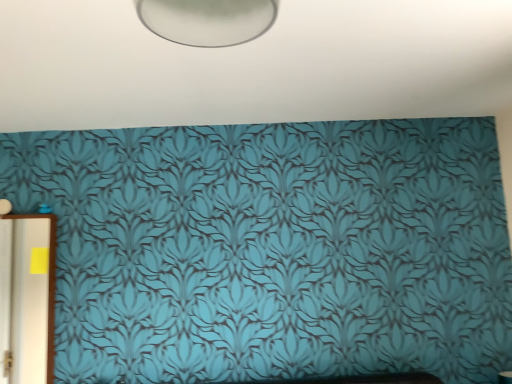
At what (x,y) coordinates should I click in order to perform the action: click on white glossy door at left. Please return your answer as a coordinate pair (x, y). The image size is (512, 384). Looking at the image, I should click on (29, 297).

What do you see at coordinates (29, 297) in the screenshot?
I see `white glossy door at left` at bounding box center [29, 297].

In order to face white glossy door at left, should I rotate leftwards or rightwards?

To align with it, rotate left about 28.681°.

What do you see at coordinates (253, 66) in the screenshot? I see `teal wallpaper at center` at bounding box center [253, 66].

Identify the location of teal wallpaper at center. The width and height of the screenshot is (512, 384). (253, 66).

You are a GUI agent. You are given a task and a screenshot of the screen. Output one action in this format:
    pyautogui.click(x=<x>, y=<y>)
    Task: Click on the white glossy door at left
    
    Given the screenshot: What is the action you would take?
    pyautogui.click(x=29, y=297)

Considering the positions of objects white glossy door at left and teal wallpaper at center in the image provided, who is more to the left, white glossy door at left or teal wallpaper at center?

Positioned to the left is white glossy door at left.

Which is in front, white glossy door at left or teal wallpaper at center?

Positioned in front is teal wallpaper at center.

Is point (30, 353) closer or farther from the camera than point (460, 115)?

Point (30, 353).

From the image's perspective, is white glossy door at left positioned above or below teal wallpaper at center?

white glossy door at left is below teal wallpaper at center.

From a real-world perspective, which object rests below the other?

From a 3D spatial view, white glossy door at left is below.

Can you confirm if white glossy door at left is thinner than teal wallpaper at center?

Indeed, white glossy door at left has a lesser width compared to teal wallpaper at center.

Is white glossy door at left shorter than teal wallpaper at center?

Incorrect, the height of white glossy door at left does not fall short of that of teal wallpaper at center.

Can you confirm if white glossy door at left is smaller than teal wallpaper at center?

Yes.

Is white glossy door at left surrounding teal wallpaper at center?

Actually, teal wallpaper at center is outside white glossy door at left.

Are white glossy door at left and teal wallpaper at center far apart?

white glossy door at left is far away from teal wallpaper at center.

Is white glossy door at left turned away from teal wallpaper at center?

No, teal wallpaper at center is not at the back of white glossy door at left.

You are a GUI agent. You are given a task and a screenshot of the screen. Output one action in this format:
    pyautogui.click(x=<x>, y=<y>)
    Task: Click on the door on the left side of teal wallpaper at center
    Image resolution: width=512 pixels, height=384 pixels.
    Given the screenshot: What is the action you would take?
    pyautogui.click(x=29, y=297)

In the image, is teal wallpaper at center on the left side or the right side of white glossy door at left?

From the image, it's evident that teal wallpaper at center is to the right of white glossy door at left.

Is the position of teal wallpaper at center less distant than that of white glossy door at left?

Yes, it is in front of white glossy door at left.

Which is closer to the camera, (429,116) or (45,299)?

Point (429,116).

From the image's perspective, is teal wallpaper at center positioned above or below white glossy door at left?

Based on their image positions, teal wallpaper at center is located above white glossy door at left.

From a real-world perspective, is teal wallpaper at center on white glossy door at left?

Correct, in the physical world, teal wallpaper at center is higher than white glossy door at left.

In terms of width, does teal wallpaper at center look wider or thinner when compared to white glossy door at left?

Considering their sizes, teal wallpaper at center looks broader than white glossy door at left.

From their relative heights in the image, would you say teal wallpaper at center is taller or shorter than white glossy door at left?

teal wallpaper at center is shorter than white glossy door at left.

Which of these two, teal wallpaper at center or white glossy door at left, is bigger?

teal wallpaper at center.

Would you say teal wallpaper at center is inside or outside white glossy door at left?

teal wallpaper at center is located beyond the bounds of white glossy door at left.

Are teal wallpaper at center and white glossy door at left beside each other?

They are not placed beside each other.

Does teal wallpaper at center turn towards white glossy door at left?

No, teal wallpaper at center is not facing towards white glossy door at left.

Can you tell me how much teal wallpaper at center and white glossy door at left differ in facing direction?

89.7 degrees.

The height and width of the screenshot is (384, 512). In order to click on backdrop in front of the white glossy door at left in this screenshot , I will do `click(253, 66)`.

Where is `backdrop on the right of white glossy door at left`? backdrop on the right of white glossy door at left is located at coordinates (253, 66).

Identify the location of door located underneath the teal wallpaper at center (from a real-world perspective). (29, 297).